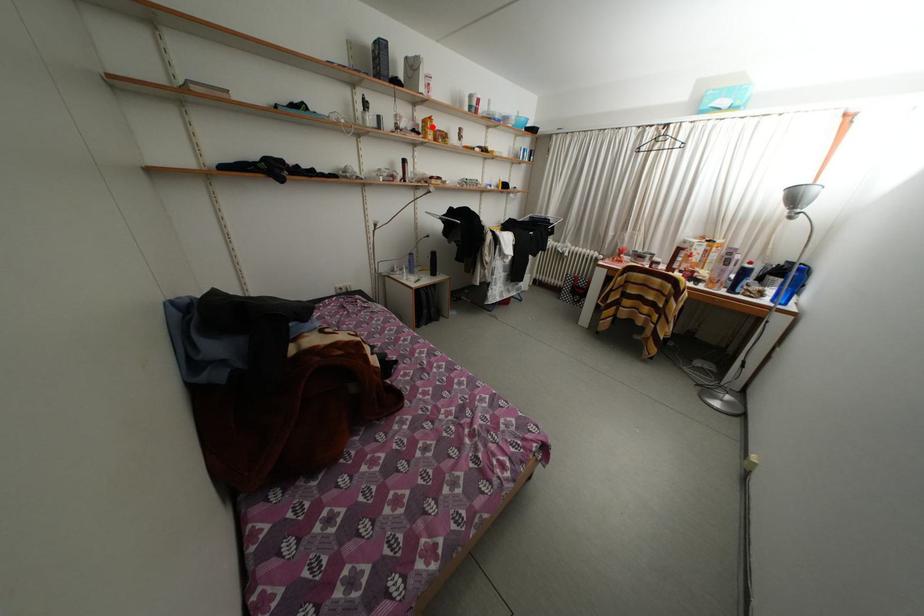
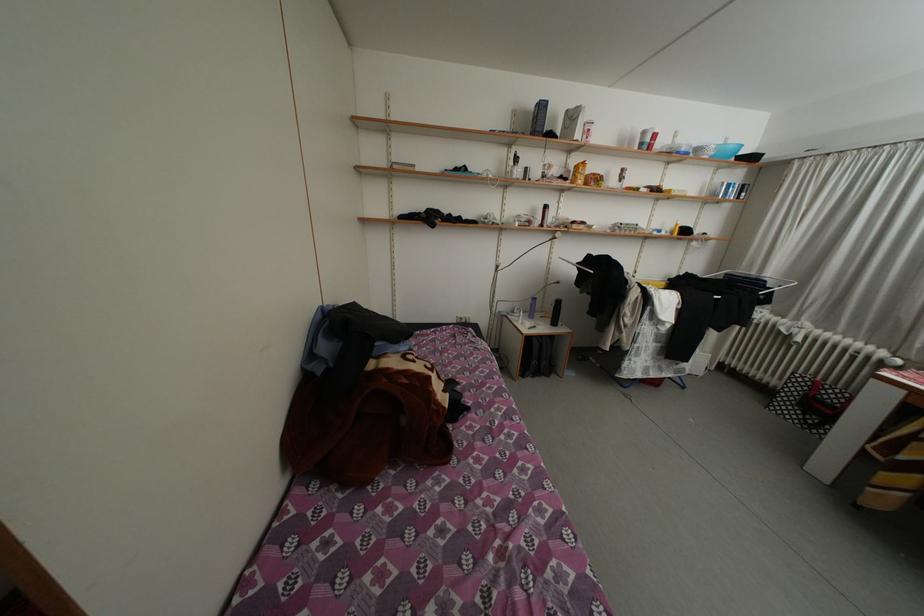
Question: I am providing you with two images of the same scene from different viewpoints. A red point is marked on the first image. Is the red point's position out of view in image 2?

Choices:
 (A) Yes
 (B) No

Answer: (B)